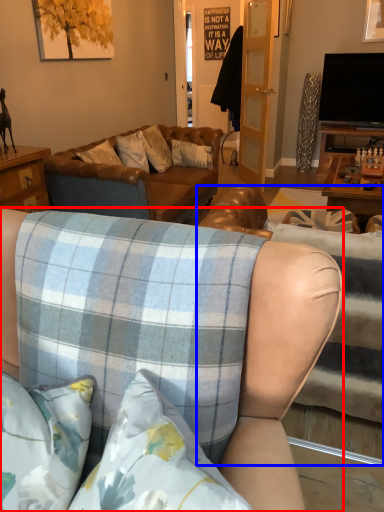
Question: Among these objects, which one is nearest to the camera, studio couch (highlighted by a red box) or studio couch (highlighted by a blue box)?

Choices:
 (A) studio couch
 (B) studio couch

Answer: (A)